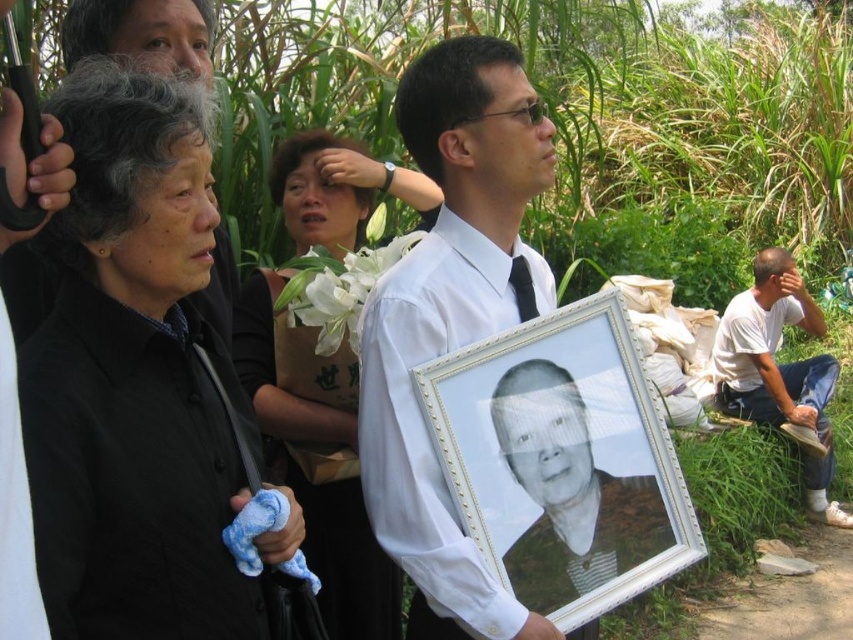
You are attending a memorial service and notice two items in the scene. The first is the black glossy photo frame at center, and the second is the white cotton shirt at lower right. Which of these two items is smaller in size?

The black glossy photo frame at center has a smaller size compared to the white cotton shirt at lower right, so the black glossy photo frame at center is the smaller item.

Looking at this image, you are a photographer taking a picture of the funeral scene. You need to focus on the black matte jacket at upper left. Where exactly should you point your camera?

You should point your camera at point [134,380] to focus on the black matte jacket at upper left.

You are standing in the middle of the scene and want to walk to both points. Which point should you reach first, point at (42,458) or point at (367,481)?

Point at (42,458) is closer to the viewer, so you should reach it first.